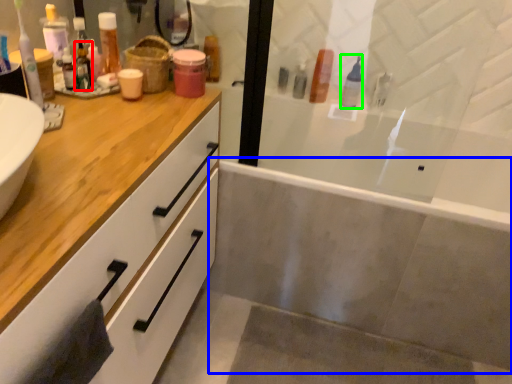
Question: Estimate the real-world distances between objects in this image. Which object is farther from toiletry (highlighted by a red box), bath (highlighted by a blue box) or toiletry (highlighted by a green box)?

Choices:
 (A) bath
 (B) toiletry

Answer: (A)